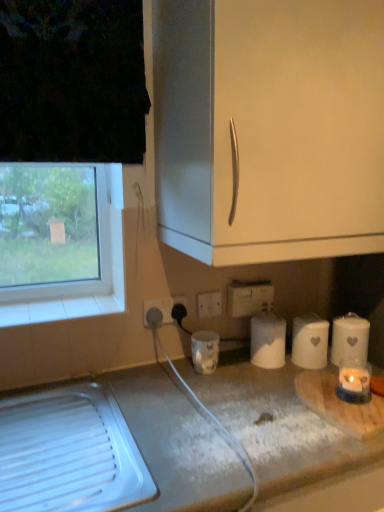
Question: From a real-world perspective, is white matte cabinet handle at upper center below white matte paper towel at center, the third paper towel when ordered from right to left?

Choices:
 (A) no
 (B) yes

Answer: (A)

Question: Can you confirm if white matte cabinet handle at upper center is taller than white matte paper towel at center, which is the first paper towel from left to right?

Choices:
 (A) yes
 (B) no

Answer: (A)

Question: Considering the relative sizes of white matte cabinet handle at upper center and white matte paper towel at center, which is the first paper towel from left to right, in the image provided, is white matte cabinet handle at upper center bigger than white matte paper towel at center, which is the first paper towel from left to right,?

Choices:
 (A) no
 (B) yes

Answer: (B)

Question: Does white matte cabinet handle at upper center have a lesser height compared to white matte paper towel at center, the third paper towel when ordered from right to left?

Choices:
 (A) yes
 (B) no

Answer: (B)

Question: Can you see white matte cabinet handle at upper center touching white matte paper towel at center, the third paper towel when ordered from right to left?

Choices:
 (A) no
 (B) yes

Answer: (A)

Question: Considering the positions of white matte countertop at lower center and white plastic power plugs and sockets at lower center in the image, is white matte countertop at lower center taller or shorter than white plastic power plugs and sockets at lower center?

Choices:
 (A) tall
 (B) short

Answer: (A)

Question: Visually, is white matte countertop at lower center positioned to the left or to the right of white plastic power plugs and sockets at lower center?

Choices:
 (A) right
 (B) left

Answer: (B)

Question: Choose the correct answer: Is white matte countertop at lower center inside white plastic power plugs and sockets at lower center or outside it?

Choices:
 (A) inside
 (B) outside

Answer: (B)

Question: Is white matte countertop at lower center bigger or smaller than white plastic power plugs and sockets at lower center?

Choices:
 (A) small
 (B) big

Answer: (B)

Question: Which is correct: white plastic electric outlet at lower center, the 2th electric outlet from the front, is inside white matte paper towel at center, which is the first paper towel from left to right, or outside of it?

Choices:
 (A) outside
 (B) inside

Answer: (A)

Question: Is white plastic electric outlet at lower center, the 2th electric outlet from the front, wider or thinner than white matte paper towel at center, which is the first paper towel from left to right?

Choices:
 (A) wide
 (B) thin

Answer: (B)

Question: Considering the relative positions of white plastic electric outlet at lower center, the first electric outlet positioned from the back, and white matte paper towel at center, the third paper towel when ordered from right to left, in the image provided, is white plastic electric outlet at lower center, the first electric outlet positioned from the back, to the left or to the right of white matte paper towel at center, the third paper towel when ordered from right to left,?

Choices:
 (A) right
 (B) left

Answer: (B)

Question: Is white plastic electric outlet at lower center, the first electric outlet positioned from the back, in front of or behind white matte paper towel at center, which is the first paper towel from left to right, in the image?

Choices:
 (A) front
 (B) behind

Answer: (B)

Question: Is point (152, 305) positioned closer to the camera than point (347, 330)?

Choices:
 (A) closer
 (B) farther

Answer: (B)

Question: Visually, is white plastic electric outlet at lower center, the 1th electric outlet in the left-to-right sequence, positioned to the left or to the right of white matte paper towel at lower right, which ranks as the 3th paper towel in left-to-right order?

Choices:
 (A) left
 (B) right

Answer: (A)